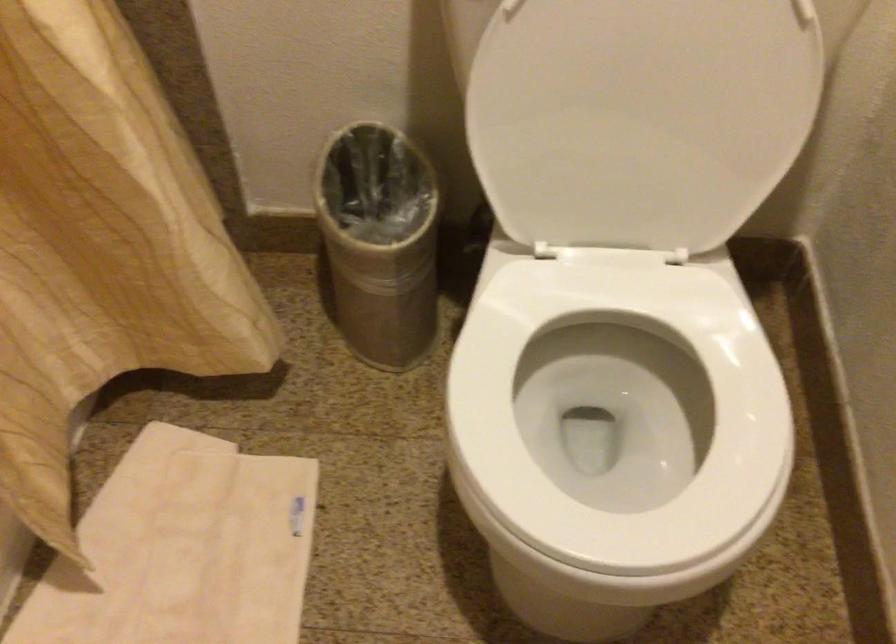
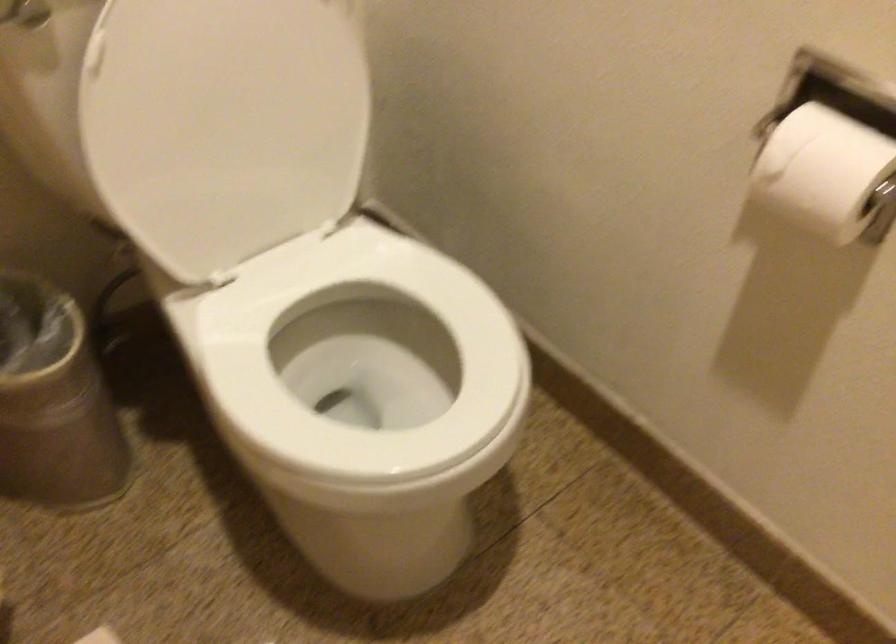
Where in the second image is the point corresponding to point 634,100 from the first image?

(239, 114)